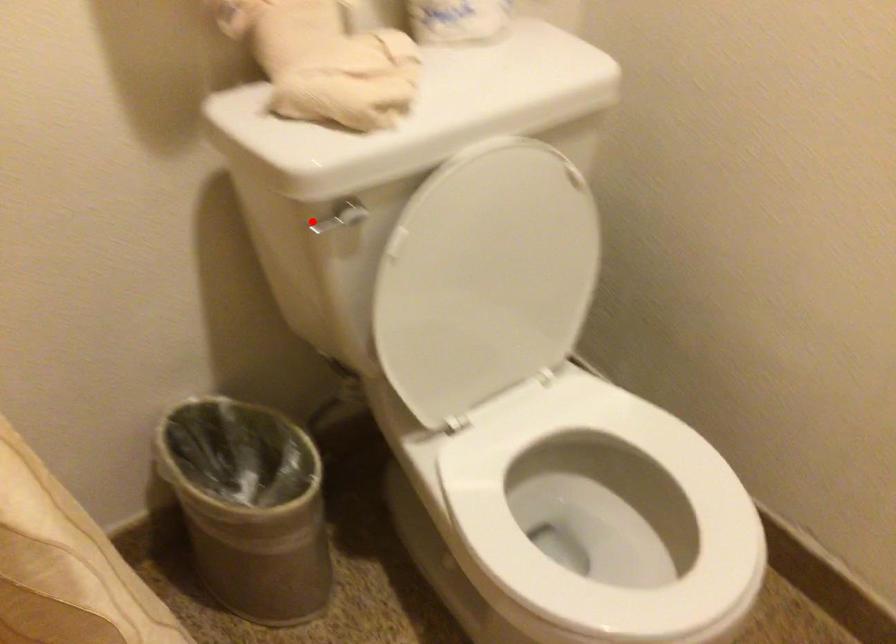
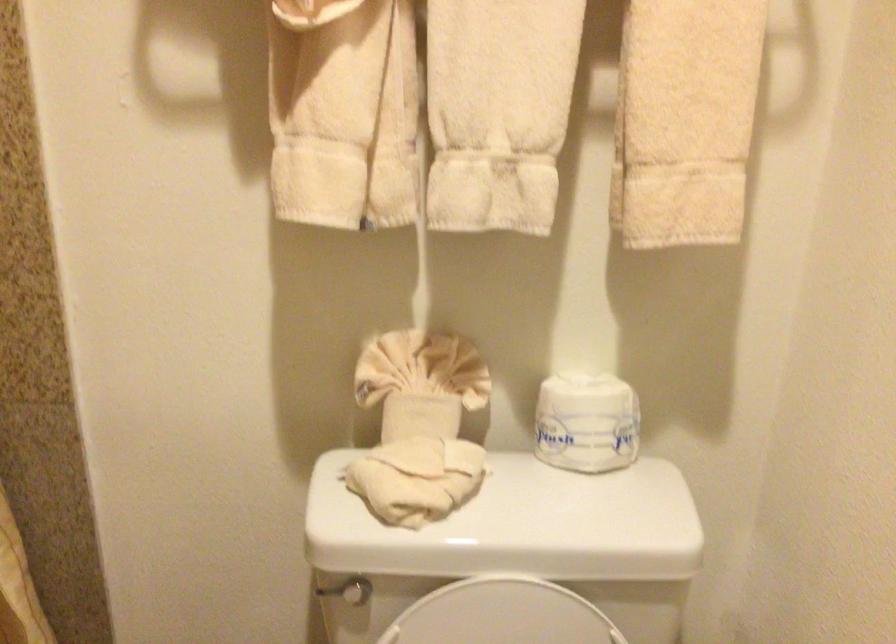
Question: I am providing you with two images of the same scene from different viewpoints. A red point is marked on the first image. Is the red point's position out of view in image 2?

Choices:
 (A) Yes
 (B) No

Answer: (B)